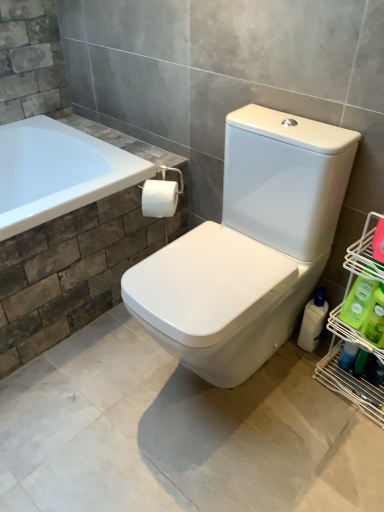
Question: Can you confirm if white matte toilet paper at center is positioned to the left of white glossy bottle at lower right, which is counted as the third cleaning product, starting from the front?

Choices:
 (A) no
 (B) yes

Answer: (B)

Question: Is white matte toilet paper at center shorter than white glossy bottle at lower right, which is counted as the third cleaning product, starting from the front?

Choices:
 (A) no
 (B) yes

Answer: (B)

Question: Is white matte toilet paper at center outside white glossy bottle at lower right, marked as the 1th cleaning product in a back-to-front arrangement?

Choices:
 (A) yes
 (B) no

Answer: (A)

Question: Considering the relative sizes of white matte toilet paper at center and white glossy bottle at lower right, marked as the 1th cleaning product in a back-to-front arrangement, in the image provided, is white matte toilet paper at center smaller than white glossy bottle at lower right, marked as the 1th cleaning product in a back-to-front arrangement,?

Choices:
 (A) no
 (B) yes

Answer: (B)

Question: Can you confirm if white matte toilet paper at center is wider than white glossy bottle at lower right, marked as the 1th cleaning product in a back-to-front arrangement?

Choices:
 (A) no
 (B) yes

Answer: (A)

Question: Relative to white matte toilet paper at center, is green plastic bottle at right, marked as the 2th cleaning product in a back-to-front arrangement, in front or behind?

Choices:
 (A) front
 (B) behind

Answer: (A)

Question: Looking at the image, does green plastic bottle at right, marked as the 2th cleaning product in a back-to-front arrangement, seem bigger or smaller compared to white matte toilet paper at center?

Choices:
 (A) big
 (B) small

Answer: (B)

Question: In terms of height, does green plastic bottle at right, marked as the 2th cleaning product in a back-to-front arrangement, look taller or shorter compared to white matte toilet paper at center?

Choices:
 (A) tall
 (B) short

Answer: (A)

Question: Does point (375, 283) appear closer or farther from the camera than point (158, 196)?

Choices:
 (A) closer
 (B) farther

Answer: (A)

Question: Is green plastic bottle at right, marked as the 2th cleaning product in a back-to-front arrangement, taller or shorter than green plastic bottle at lower right, placed as the first cleaning product when sorted from front to back?

Choices:
 (A) tall
 (B) short

Answer: (B)

Question: From the image's perspective, relative to green plastic bottle at lower right, placed as the first cleaning product when sorted from front to back, is green plastic bottle at right, which is the second cleaning product from front to back, above or below?

Choices:
 (A) above
 (B) below

Answer: (A)

Question: Visually, is green plastic bottle at right, which is the second cleaning product from front to back, positioned to the left or to the right of green plastic bottle at lower right, which is counted as the third cleaning product, starting from the back?

Choices:
 (A) left
 (B) right

Answer: (A)

Question: Is green plastic bottle at right, marked as the 2th cleaning product in a back-to-front arrangement, bigger or smaller than green plastic bottle at lower right, placed as the first cleaning product when sorted from front to back?

Choices:
 (A) big
 (B) small

Answer: (B)

Question: Considering the positions of white matte toilet paper at center and white glossy bottle at lower right, which is counted as the third cleaning product, starting from the front, in the image, is white matte toilet paper at center wider or thinner than white glossy bottle at lower right, which is counted as the third cleaning product, starting from the front,?

Choices:
 (A) thin
 (B) wide

Answer: (A)

Question: From the image's perspective, relative to white glossy bottle at lower right, which is counted as the third cleaning product, starting from the front, is white matte toilet paper at center above or below?

Choices:
 (A) above
 (B) below

Answer: (A)